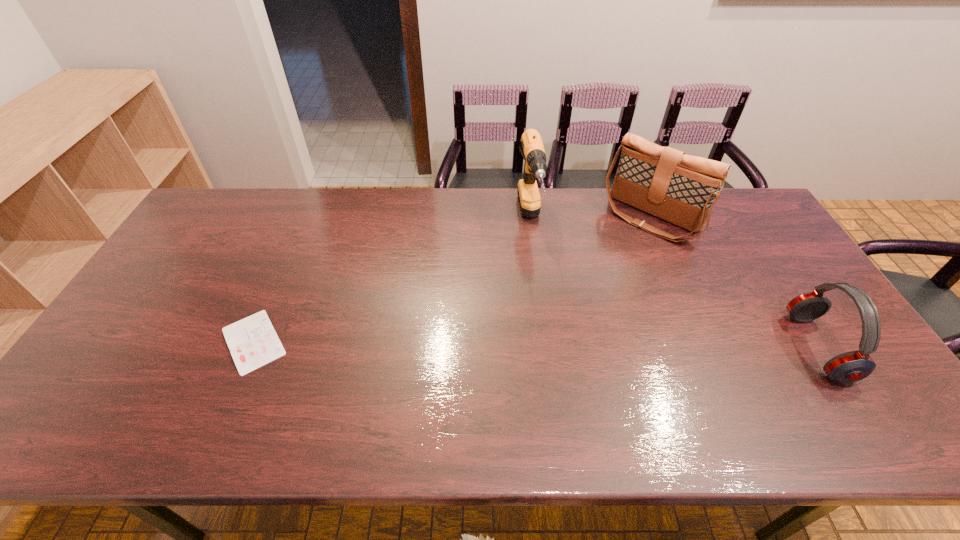
The image size is (960, 540). I want to click on vacant space located 0.200m on the front-facing side of the second object from right to left, so click(598, 275).

The height and width of the screenshot is (540, 960). I want to click on free space located 0.390m on the front-facing side of the second object from right to left, so click(x=564, y=313).

Find the location of a particular element. Image resolution: width=960 pixels, height=540 pixels. vacant space located on the front-facing side of the second object from right to left is located at coordinates (596, 277).

The image size is (960, 540). I want to click on drill that is at the far edge, so click(x=535, y=165).

You are a GUI agent. You are given a task and a screenshot of the screen. Output one action in this format:
    pyautogui.click(x=<x>, y=<y>)
    Task: Click on the shoulder bag located at the far edge
    
    Given the screenshot: What is the action you would take?
    pyautogui.click(x=681, y=189)

Locate an element on the screen. The height and width of the screenshot is (540, 960). diary situated at the near edge is located at coordinates (253, 342).

I want to click on earphone located at the near edge, so pos(852,366).

You are a GUI agent. You are given a task and a screenshot of the screen. Output one action in this format:
    pyautogui.click(x=<x>, y=<y>)
    Task: Click on the object at the right edge
    Image resolution: width=960 pixels, height=540 pixels.
    Given the screenshot: What is the action you would take?
    pyautogui.click(x=852, y=366)

Locate an element on the screen. The height and width of the screenshot is (540, 960). object present at the near right corner is located at coordinates (852, 366).

This screenshot has width=960, height=540. What are the coordinates of `vacant space at the far edge of the desktop` in the screenshot? It's located at (299, 225).